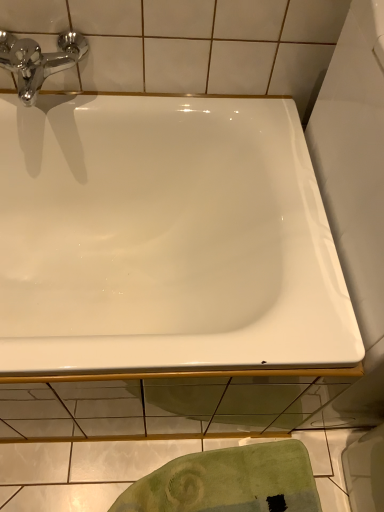
I want to click on vacant area on top of green textured towel at lower center (from a real-world perspective), so click(159, 476).